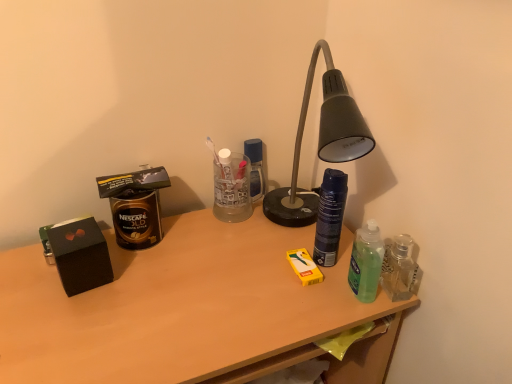
Question: From a real-world perspective, does green translucent bottle at right, which is the 2th bottle in left-to-right order, sit lower than gold matte canister at left?

Choices:
 (A) no
 (B) yes

Answer: (B)

Question: Is green translucent bottle at right, which is the first bottle in right-to-left order, oriented towards gold matte canister at left?

Choices:
 (A) yes
 (B) no

Answer: (B)

Question: Are green translucent bottle at right, which is the first bottle in right-to-left order, and gold matte canister at left far apart?

Choices:
 (A) yes
 (B) no

Answer: (B)

Question: Is green translucent bottle at right, which is the first bottle in right-to-left order, facing away from gold matte canister at left?

Choices:
 (A) no
 (B) yes

Answer: (A)

Question: Does green translucent bottle at right, which is the first bottle in right-to-left order, have a larger size compared to gold matte canister at left?

Choices:
 (A) yes
 (B) no

Answer: (B)

Question: Is green translucent bottle at right, which is the 2th bottle in left-to-right order, wider than gold matte canister at left?

Choices:
 (A) no
 (B) yes

Answer: (A)

Question: Considering the relative positions of gold matte canister at left and dark blue matte spray can at center, positioned as the 1th bottle in left-to-right order, in the image provided, is gold matte canister at left behind dark blue matte spray can at center, positioned as the 1th bottle in left-to-right order,?

Choices:
 (A) yes
 (B) no

Answer: (A)

Question: Does gold matte canister at left touch dark blue matte spray can at center, the second bottle from the right?

Choices:
 (A) no
 (B) yes

Answer: (A)

Question: From the image's perspective, is gold matte canister at left under dark blue matte spray can at center, positioned as the 1th bottle in left-to-right order?

Choices:
 (A) yes
 (B) no

Answer: (B)

Question: Is gold matte canister at left bigger than dark blue matte spray can at center, positioned as the 1th bottle in left-to-right order?

Choices:
 (A) yes
 (B) no

Answer: (A)

Question: Is gold matte canister at left oriented towards dark blue matte spray can at center, the second bottle from the right?

Choices:
 (A) no
 (B) yes

Answer: (A)

Question: Is gold matte canister at left shorter than dark blue matte spray can at center, positioned as the 1th bottle in left-to-right order?

Choices:
 (A) no
 (B) yes

Answer: (B)

Question: Can you confirm if dark blue matte spray can at center, positioned as the 1th bottle in left-to-right order, is taller than wooden desk at center?

Choices:
 (A) no
 (B) yes

Answer: (A)